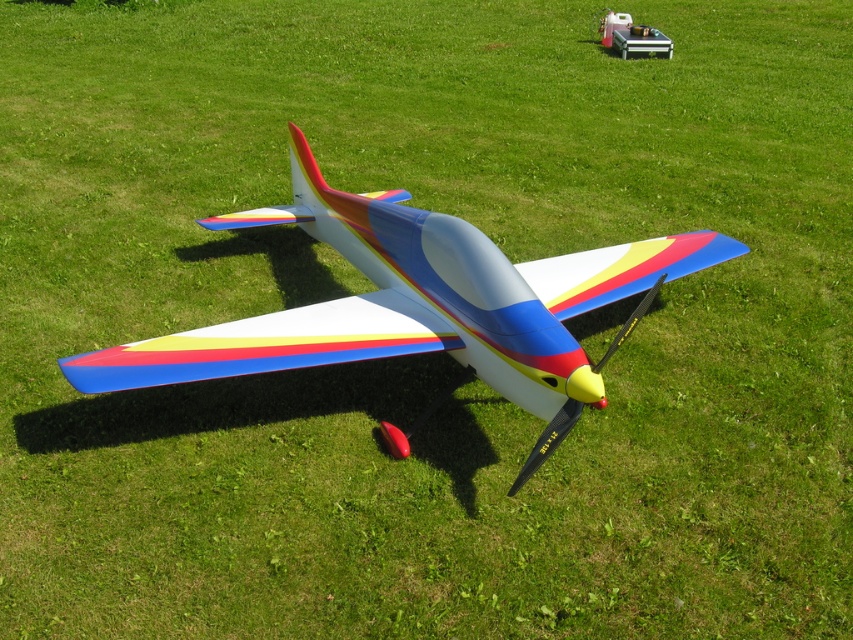
Does matte plastic airplane at center have a smaller size compared to metallic silver toolbox at upper center?

Incorrect, matte plastic airplane at center is not smaller in size than metallic silver toolbox at upper center.

Which is behind, point (654, 291) or point (614, 33)?

The point (614, 33) is behind.

What do you see at coordinates (421, 305) in the screenshot?
I see `matte plastic airplane at center` at bounding box center [421, 305].

At what (x,y) coordinates should I click in order to perform the action: click on matte plastic airplane at center. Please return your answer as a coordinate pair (x, y). The height and width of the screenshot is (640, 853). Looking at the image, I should click on (421, 305).